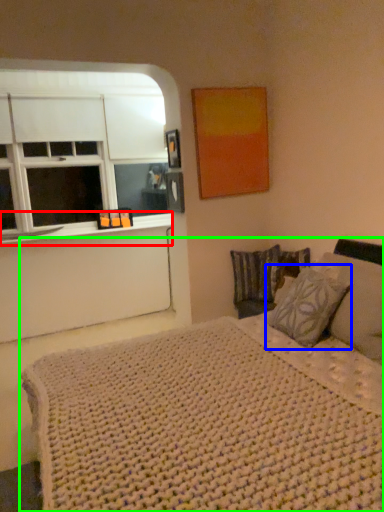
Question: Considering the real-world distances, which object is farthest from window sill (highlighted by a red box)? pillow (highlighted by a blue box) or bed (highlighted by a green box)?

Choices:
 (A) pillow
 (B) bed

Answer: (B)